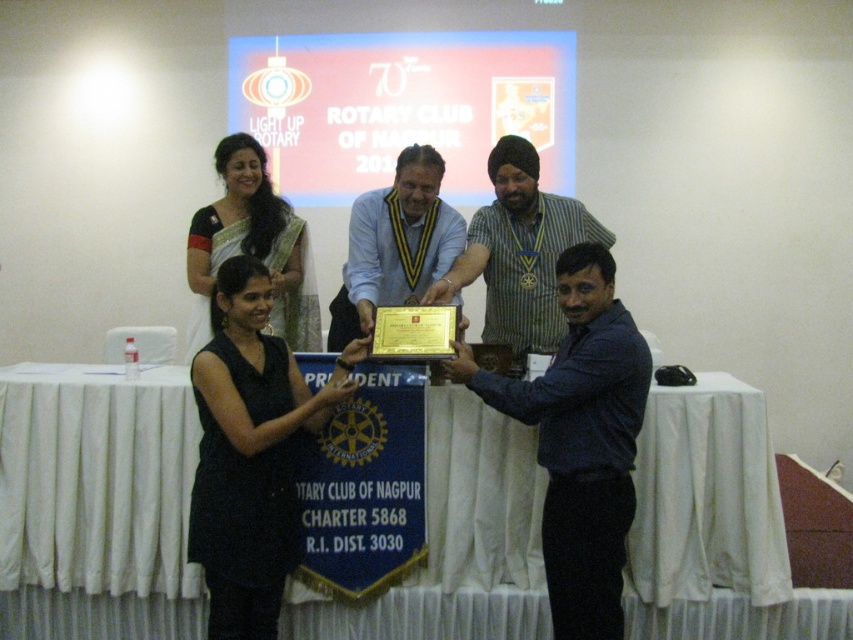
Question: Which object is the closest to the black dress at center?

Choices:
 (A) white cloth-covered table at center
 (B) blue denim shirt at center

Answer: (A)

Question: Where is white cloth-covered table at center located in relation to green silk saree at upper left in the image?

Choices:
 (A) left
 (B) right

Answer: (A)

Question: Which of the following is the closest to the observer?

Choices:
 (A) green silk saree at upper left
 (B) gold plated plaque at center
 (C) black dress at center
 (D) matte gold plaque at center

Answer: (C)

Question: Considering the relative positions of black dress at center and gold plated plaque at center in the image provided, where is black dress at center located with respect to gold plated plaque at center?

Choices:
 (A) below
 (B) above

Answer: (A)

Question: Is blue denim shirt at center below matte gold plaque at center?

Choices:
 (A) yes
 (B) no

Answer: (A)

Question: Which of these objects is positioned closest to the white cloth-covered table at center?

Choices:
 (A) black dress at center
 (B) gold plated plaque at center

Answer: (A)